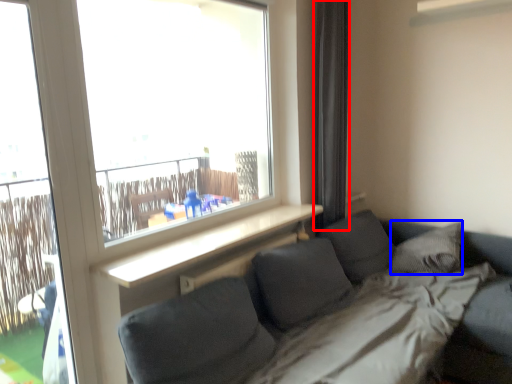
Question: Which object appears closest to the camera in this image, curtain (highlighted by a red box) or pillow (highlighted by a blue box)?

Choices:
 (A) curtain
 (B) pillow

Answer: (B)